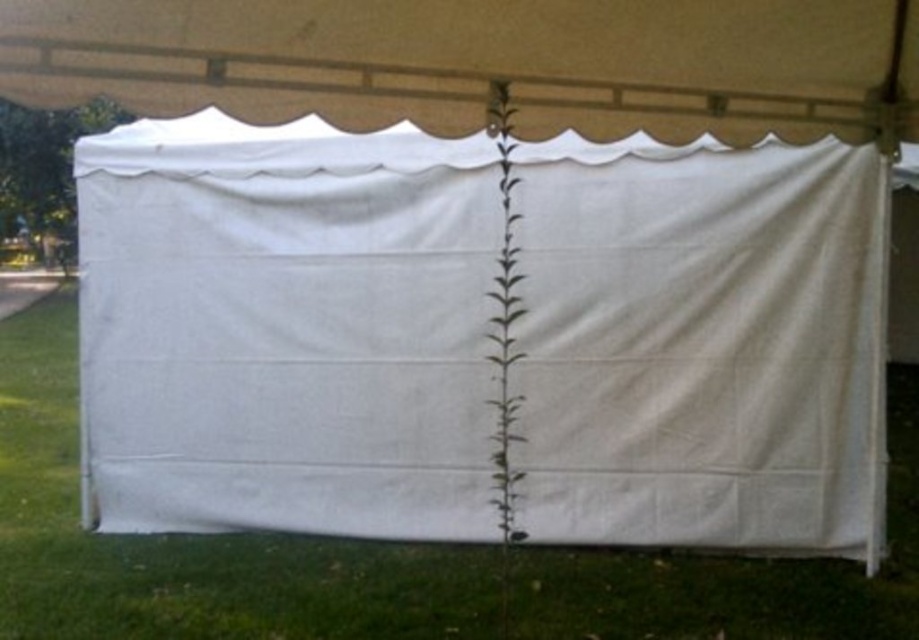
Who is lower down, white fabric canopy at upper center or green grass at lower center?

Positioned lower is green grass at lower center.

Who is more distant from viewer, (168, 99) or (892, 625)?

The point (892, 625) is behind.

Between point (451, 12) and point (112, 545), which one is positioned in front?

Positioned in front is point (451, 12).

Where is `white fabric canopy at upper center`? This screenshot has width=919, height=640. white fabric canopy at upper center is located at coordinates (483, 61).

Can you confirm if green grass at lower center is positioned to the left of green leafy plant at center?

No, green grass at lower center is not to the left of green leafy plant at center.

Which is below, green grass at lower center or green leafy plant at center?

green grass at lower center

Describe the element at coordinates (190, 541) in the screenshot. I see `green grass at lower center` at that location.

Image resolution: width=919 pixels, height=640 pixels. In order to click on green grass at lower center in this screenshot , I will do `click(190, 541)`.

Who is more distant from viewer, (x=910, y=120) or (x=501, y=362)?

Positioned behind is point (x=501, y=362).

Does point (314, 8) lie in front of point (488, 109)?

Yes.

Describe the element at coordinates (483, 61) in the screenshot. The width and height of the screenshot is (919, 640). I see `white fabric canopy at upper center` at that location.

Locate an element on the screen. white fabric canopy at upper center is located at coordinates (483, 61).